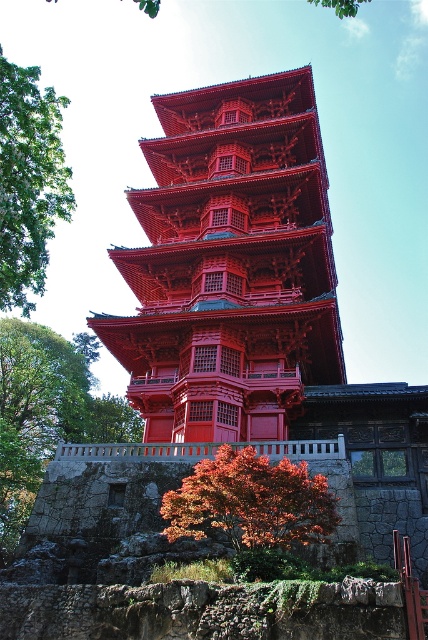
Between matte wood pagoda at center and green leafy tree at upper left, which one is positioned lower?

matte wood pagoda at center is lower down.

Is point (300, 257) positioned after point (38, 276)?

No.

Identify the location of matte wood pagoda at center. The image size is (428, 640). (229, 266).

Does green leafy tree at upper left appear under shiny red maple tree at lower center?

No.

Is green leafy tree at upper left to the right of shiny red maple tree at lower center from the viewer's perspective?

Incorrect, green leafy tree at upper left is not on the right side of shiny red maple tree at lower center.

Describe the element at coordinates (29, 180) in the screenshot. I see `green leafy tree at upper left` at that location.

The image size is (428, 640). I want to click on green leafy tree at upper left, so click(29, 180).

At what (x,y) coordinates should I click in order to perform the action: click on matte wood pagoda at center. Please return your answer as a coordinate pair (x, y). Looking at the image, I should click on point(229,266).

Between point (293, 72) and point (311, 490), which one is positioned in front?

Point (311, 490) is more forward.

Where is `matte wood pagoda at center`? matte wood pagoda at center is located at coordinates pyautogui.click(x=229, y=266).